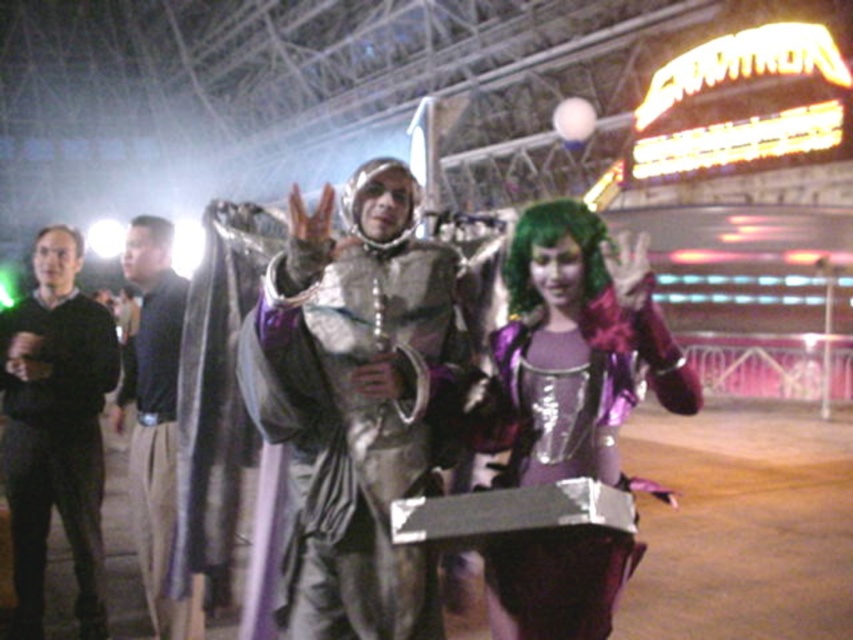
Looking at this image, you are a photographer setting up a camera at the convention. You want to take a photo of both the dark brown leather jacket at left and the green synthetic wig at center. The camera can only focus on objects within a 10 feet range. Will both objects be in focus?

The dark brown leather jacket at left and green synthetic wig at center are 8.62 feet apart from each other. Since the distance between them is within the camera focus range of 10 feet, both objects will be in focus.

You are standing in the convention center and notice a black matte sweater at left. Where exactly is it positioned in the image?

The black matte sweater at left is located at point coordinates of 0.677 on the x axis and 0.066 on the y axis.